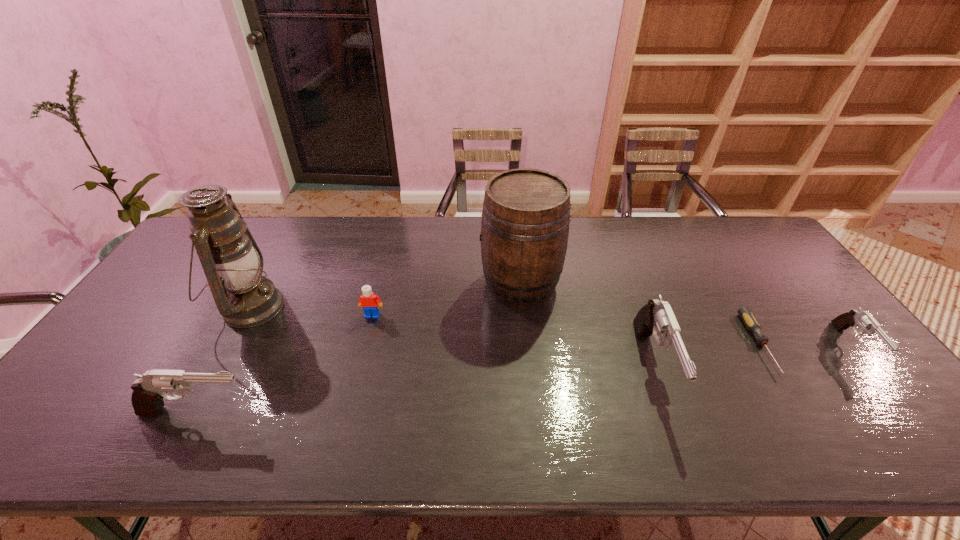
You are a GUI agent. You are given a task and a screenshot of the screen. Output one action in this format:
    pyautogui.click(x=<x>, y=<y>)
    Task: Click on the free spot between the Lego and the rightmost gun
    The height and width of the screenshot is (540, 960).
    Given the screenshot: What is the action you would take?
    pyautogui.click(x=612, y=331)

In order to click on empty space between the oil lamp and the third object from right to left in this screenshot , I will do `click(452, 337)`.

Find the location of a particular element. free space between the cider and the second gun from left to right is located at coordinates (587, 325).

Find the location of a particular element. The height and width of the screenshot is (540, 960). the fifth closest object to the cider is located at coordinates (149, 390).

This screenshot has width=960, height=540. Identify the location of object that is the sixth nearest to the oil lamp. (854, 318).

Identify the location of the third closest gun to the fourth object from right to left. This screenshot has height=540, width=960. (854, 318).

Identify which gun is located as the second nearest to the second gun from right to left. Please provide its 2D coordinates. Your answer should be formatted as a tuple, i.e. [(x, y)], where the tuple contains the x and y coordinates of a point satisfying the conditions above.

[(149, 390)]

You are a GUI agent. You are given a task and a screenshot of the screen. Output one action in this format:
    pyautogui.click(x=<x>, y=<y>)
    Task: Click on the free region that satisfies the following two spatial constraints: 1. on the face of the Lego; 2. at the muzzle of the second shortest gun
    Image resolution: width=960 pixels, height=540 pixels.
    Given the screenshot: What is the action you would take?
    pyautogui.click(x=348, y=412)

Identify the location of vacant area that satisfies the following two spatial constraints: 1. on the face of the Lego; 2. at the muzzle of the fourth tallest object. The image size is (960, 540). (348, 412).

Identify the location of free location that satisfies the following two spatial constraints: 1. insert the sixth object from left to right into a screw head; 2. at the muzzle of the leftmost gun. (802, 412).